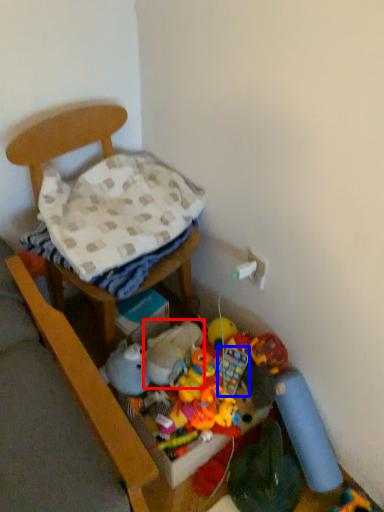
Question: Which object is further to the camera taking this photo, toy (highlighted by a red box) or toy (highlighted by a blue box)?

Choices:
 (A) toy
 (B) toy

Answer: (B)